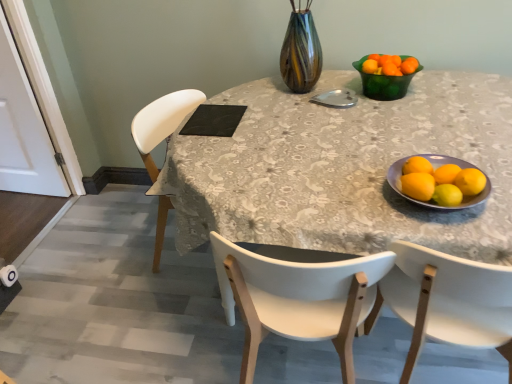
Question: Visually, is yellow matte lemon at right, positioned as the fourth lemon in right-to-left order, positioned to the left or to the right of orange matte tangerine at upper right, marked as the second tangerine in a left-to-right arrangement?

Choices:
 (A) left
 (B) right

Answer: (A)

Question: Is yellow matte lemon at right, positioned as the fourth lemon in right-to-left order, in front of or behind orange matte tangerine at upper right, marked as the second tangerine in a left-to-right arrangement, in the image?

Choices:
 (A) behind
 (B) front

Answer: (B)

Question: Which is nearer to the yellow matte/orange at right?

Choices:
 (A) orange matte tangerine at upper right, marked as the second tangerine in a left-to-right arrangement
 (B) white plastic chair at left
 (C) yellow matte lemon at right, the fourth lemon positioned from the left
 (D) yellow matte lemon at lower right, the 3th lemon viewed from the left
 (E) white plastic chair at right, the 1th chair in the right-to-left sequence

Answer: (C)

Question: Which of these objects is positioned closest to the yellow matte lemon at lower right, the second lemon when ordered from right to left?

Choices:
 (A) orange matte tangerine at upper right, placed as the 1th tangerine when sorted from left to right
 (B) yellow matte/orange at right
 (C) white wood chair at center, which is the 1th chair from left to right
 (D) yellow matte lemon at right, which is the second lemon from left to right
 (E) orange matte tangerine at upper right, which ranks as the first tangerine in right-to-left order

Answer: (B)